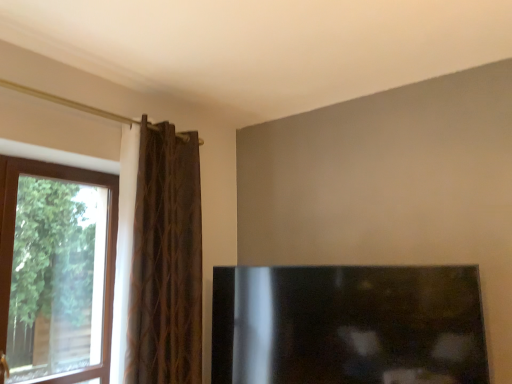
Locate an element on the screen. The height and width of the screenshot is (384, 512). brown textured curtain at left is located at coordinates (166, 261).

What is the approximate width of black glossy fireplace at lower right?

It is 2.63 inches.

The height and width of the screenshot is (384, 512). What are the coordinates of `transparent glass window at left` in the screenshot? It's located at (56, 272).

Is transparent glass window at left oriented towards black glossy fireplace at lower right?

No.

From the image's perspective, does transparent glass window at left appear higher than black glossy fireplace at lower right?

Yes, from the image's perspective, transparent glass window at left is above black glossy fireplace at lower right.

Which is farther, (106, 382) or (350, 351)?

The point (106, 382) is farther.

Considering the relative sizes of transparent glass window at left and black glossy fireplace at lower right in the image provided, is transparent glass window at left thinner than black glossy fireplace at lower right?

Incorrect, the width of transparent glass window at left is not less than that of black glossy fireplace at lower right.

Considering the sizes of objects transparent glass window at left and brown textured curtain at left in the image provided, who is shorter, transparent glass window at left or brown textured curtain at left?

Standing shorter between the two is transparent glass window at left.

From the image's perspective, which one is positioned higher, transparent glass window at left or brown textured curtain at left?

brown textured curtain at left appears higher in the image.

Where is `window on the left of brown textured curtain at left`? This screenshot has height=384, width=512. window on the left of brown textured curtain at left is located at coordinates (56, 272).

Between transparent glass window at left and brown textured curtain at left, which one has smaller size?

transparent glass window at left is smaller.

Does black glossy fireplace at lower right turn towards brown textured curtain at left?

Yes, black glossy fireplace at lower right is facing brown textured curtain at left.

From the picture: Is black glossy fireplace at lower right behind brown textured curtain at left?

No, it is in front of brown textured curtain at left.

Which of these two, black glossy fireplace at lower right or brown textured curtain at left, is wider?

brown textured curtain at left is wider.

Can you confirm if black glossy fireplace at lower right is positioned to the right of brown textured curtain at left?

Yes, black glossy fireplace at lower right is to the right of brown textured curtain at left.

Is black glossy fireplace at lower right aimed at transparent glass window at left?

No, black glossy fireplace at lower right is not aimed at transparent glass window at left.

Which is behind, point (420, 308) or point (71, 187)?

The point (71, 187) is farther from the camera.

From the image's perspective, which one is positioned lower, black glossy fireplace at lower right or transparent glass window at left?

From the image's view, black glossy fireplace at lower right is below.

In the scene shown: From a real-world perspective, does black glossy fireplace at lower right stand above transparent glass window at left?

Actually, black glossy fireplace at lower right is physically below transparent glass window at left in the real world.

Is brown textured curtain at left behind transparent glass window at left?

Yes, it is.

Which is further, (x=132, y=267) or (x=12, y=221)?

Positioned behind is point (x=12, y=221).

Could you tell me if brown textured curtain at left is turned towards transparent glass window at left?

No, brown textured curtain at left is not aimed at transparent glass window at left.

Who is more distant, brown textured curtain at left or black glossy fireplace at lower right?

brown textured curtain at left is further from the camera.

Between point (179, 217) and point (405, 327), which one is positioned behind?

The point (179, 217) is behind.

Which object is positioned more to the left, brown textured curtain at left or black glossy fireplace at lower right?

brown textured curtain at left.

Is black glossy fireplace at lower right at the back of brown textured curtain at left?

No, brown textured curtain at left is not facing the opposite direction of black glossy fireplace at lower right.

Identify the location of fireplace on the right of transparent glass window at left. 348,325.

I want to click on window below the brown textured curtain at left (from a real-world perspective), so click(x=56, y=272).

Based on their spatial positions, is brown textured curtain at left or black glossy fireplace at lower right closer to transparent glass window at left?

The object closer to transparent glass window at left is brown textured curtain at left.

Looking at the image, which one is located further to brown textured curtain at left, transparent glass window at left or black glossy fireplace at lower right?

black glossy fireplace at lower right.

Based on their spatial positions, is black glossy fireplace at lower right or transparent glass window at left further from brown textured curtain at left?

Based on the image, black glossy fireplace at lower right appears to be further to brown textured curtain at left.

Estimate the real-world distances between objects in this image. Which object is further from black glossy fireplace at lower right, brown textured curtain at left or transparent glass window at left?

Based on the image, transparent glass window at left appears to be further to black glossy fireplace at lower right.

From the image, which object appears to be nearer to transparent glass window at left, black glossy fireplace at lower right or brown textured curtain at left?

brown textured curtain at left is closer to transparent glass window at left.

From the image, which object appears to be nearer to black glossy fireplace at lower right, transparent glass window at left or brown textured curtain at left?

Among the two, brown textured curtain at left is located nearer to black glossy fireplace at lower right.

The width and height of the screenshot is (512, 384). Find the location of `curtain located between transparent glass window at left and black glossy fireplace at lower right in the left-right direction`. curtain located between transparent glass window at left and black glossy fireplace at lower right in the left-right direction is located at coordinates (166, 261).